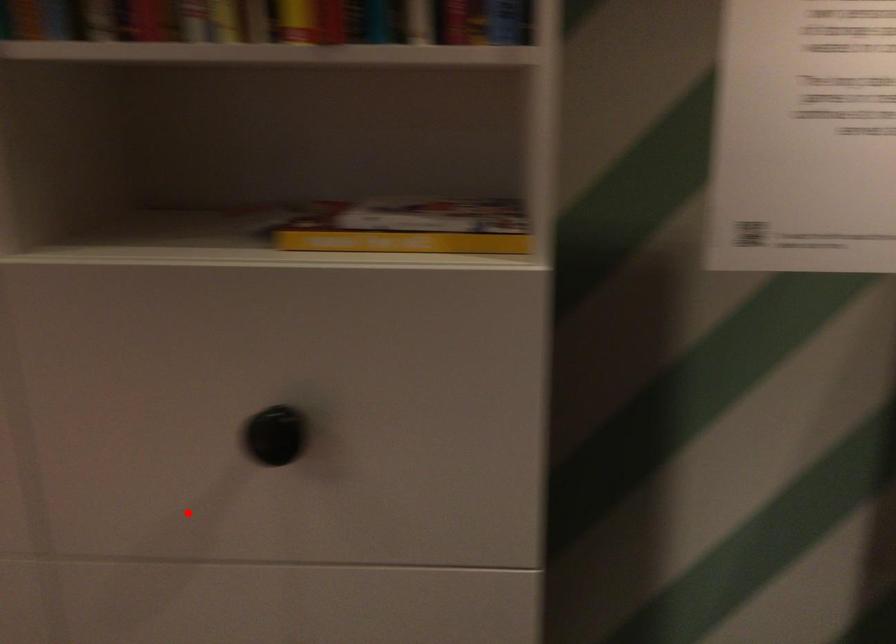
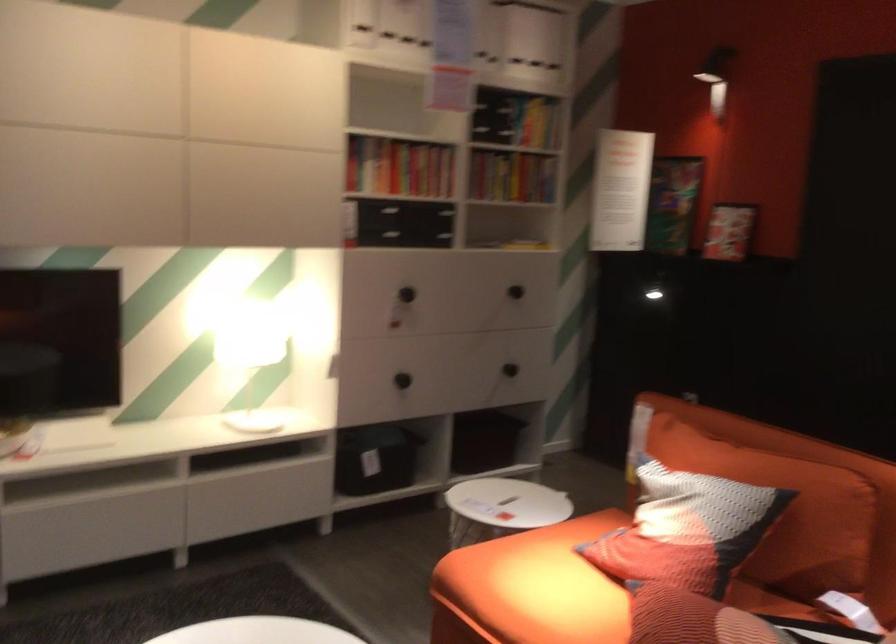
Question: I am providing you with two images of the same scene from different viewpoints. In image1, a red point is highlighted. Considering the same 3D point in image2, which of the following is correct?

Choices:
 (A) It is closer
 (B) It is farther

Answer: (B)